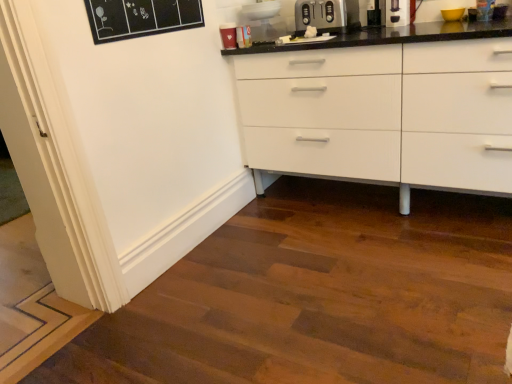
Question: From a real-world perspective, is black plastic coffee machine at upper right positioned above or below satin silver toaster at upper center?

Choices:
 (A) below
 (B) above

Answer: (B)

Question: Is black plastic coffee machine at upper right to the left or to the right of satin silver toaster at upper center in the image?

Choices:
 (A) left
 (B) right

Answer: (B)

Question: From the image's perspective, is black plastic coffee machine at upper right positioned above or below satin silver toaster at upper center?

Choices:
 (A) below
 (B) above

Answer: (B)

Question: Is point (335, 6) positioned closer to the camera than point (372, 13)?

Choices:
 (A) farther
 (B) closer

Answer: (A)

Question: In the image, is satin silver toaster at upper center positioned in front of or behind black plastic coffee machine at upper right?

Choices:
 (A) behind
 (B) front

Answer: (A)

Question: From the image's perspective, is satin silver toaster at upper center located above or below black plastic coffee machine at upper right?

Choices:
 (A) below
 (B) above

Answer: (A)

Question: Is satin silver toaster at upper center situated inside black plastic coffee machine at upper right or outside?

Choices:
 (A) outside
 (B) inside

Answer: (A)